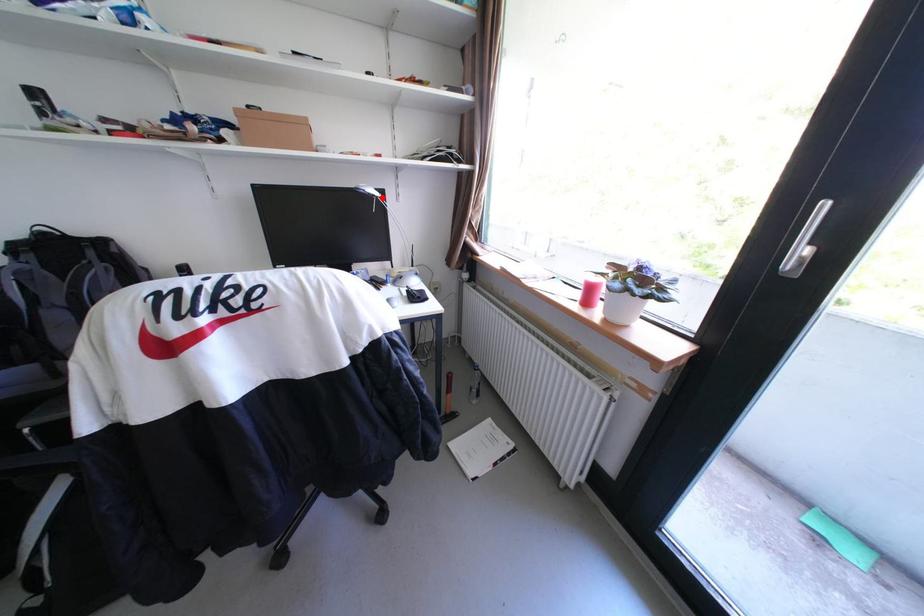
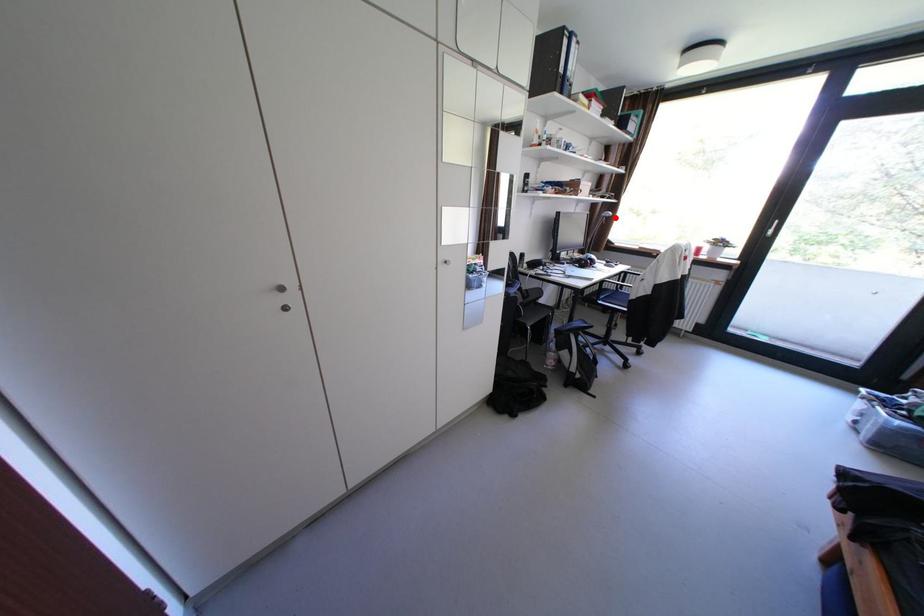
I am providing you with two images of the same scene from different viewpoints. A red point is marked on the first image and another point is marked on the second image. Is the marked point in image1 the same physical position as the marked point in image2?

Yes